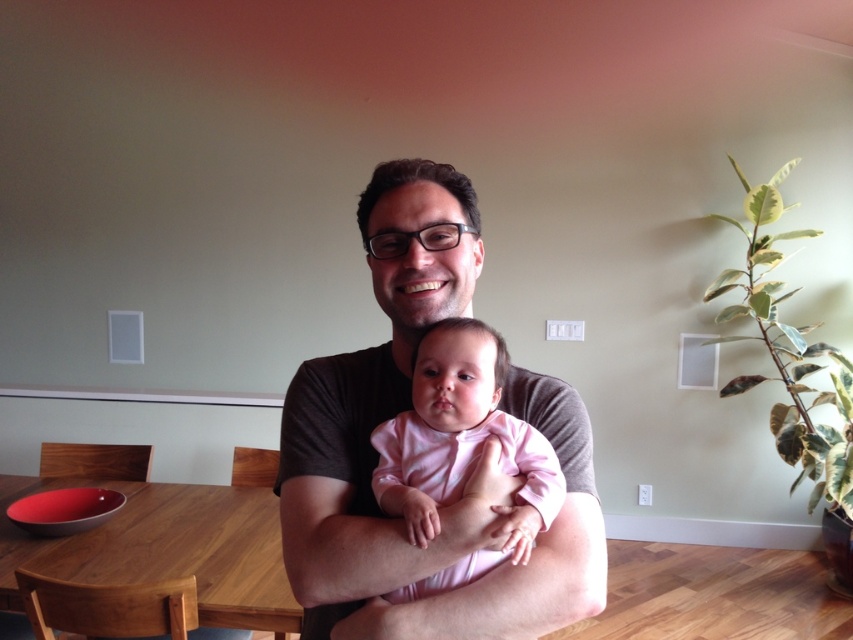
Question: Which object is farther from the camera taking this photo?

Choices:
 (A) wooden table at lower left
 (B) pink matte onesie at center
 (C) matte black shirt at center

Answer: (A)

Question: Which of the following is the farthest from the observer?

Choices:
 (A) wooden table at lower left
 (B) matte black shirt at center

Answer: (A)

Question: Which point appears farthest from the camera in this image?

Choices:
 (A) (556, 477)
 (B) (334, 358)
 (C) (148, 564)

Answer: (C)

Question: Does wooden table at lower left have a larger size compared to pink matte onesie at center?

Choices:
 (A) no
 (B) yes

Answer: (B)

Question: From the image, what is the correct spatial relationship of wooden table at lower left in relation to pink matte onesie at center?

Choices:
 (A) right
 (B) left

Answer: (B)

Question: Is matte black shirt at center to the left of wooden table at lower left from the viewer's perspective?

Choices:
 (A) no
 (B) yes

Answer: (A)